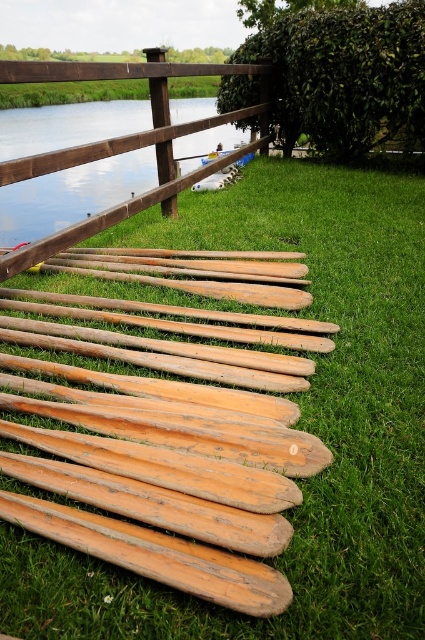
Can you confirm if wooden oar at center is positioned to the right of wooden canoe at center?

No, wooden oar at center is not to the right of wooden canoe at center.

Which of these two, wooden oar at center or wooden canoe at center, stands shorter?

wooden oar at center is shorter.

Who is more distant from viewer, (x=297, y=330) or (x=212, y=156)?

The point (x=212, y=156) is more distant.

Where is `wooden oar at center`? This screenshot has height=640, width=425. wooden oar at center is located at coordinates (175, 310).

Who is more distant from viewer, (x=204, y=596) or (x=195, y=525)?

Positioned behind is point (x=195, y=525).

Between light brown wooden oar at center and light brown wooden oar at lower left, which one is positioned higher?

Positioned higher is light brown wooden oar at lower left.

Which is behind, point (252, 604) or point (229, 544)?

The point (229, 544) is behind.

I want to click on light brown wooden oar at center, so click(x=155, y=556).

Is green leafy hedge at upper center positioned behind wooden oar at center?

Yes.

Does green leafy hedge at upper center appear under wooden oar at center?

No, green leafy hedge at upper center is not below wooden oar at center.

Which is in front, point (422, 106) or point (300, 324)?

Positioned in front is point (300, 324).

This screenshot has width=425, height=640. Find the location of `green leafy hedge at upper center`. green leafy hedge at upper center is located at coordinates (345, 76).